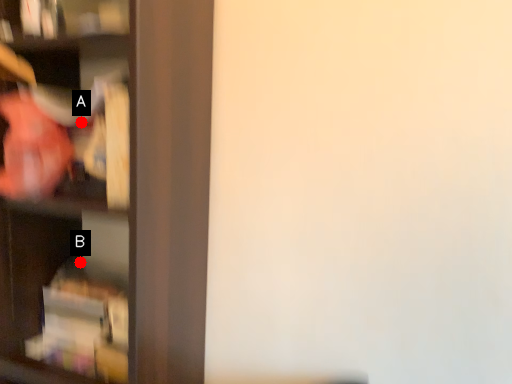
Question: Two points are circled on the image, labeled by A and B beside each circle. Which of the following is the closest to the observer?

Choices:
 (A) A is closer
 (B) B is closer

Answer: (A)